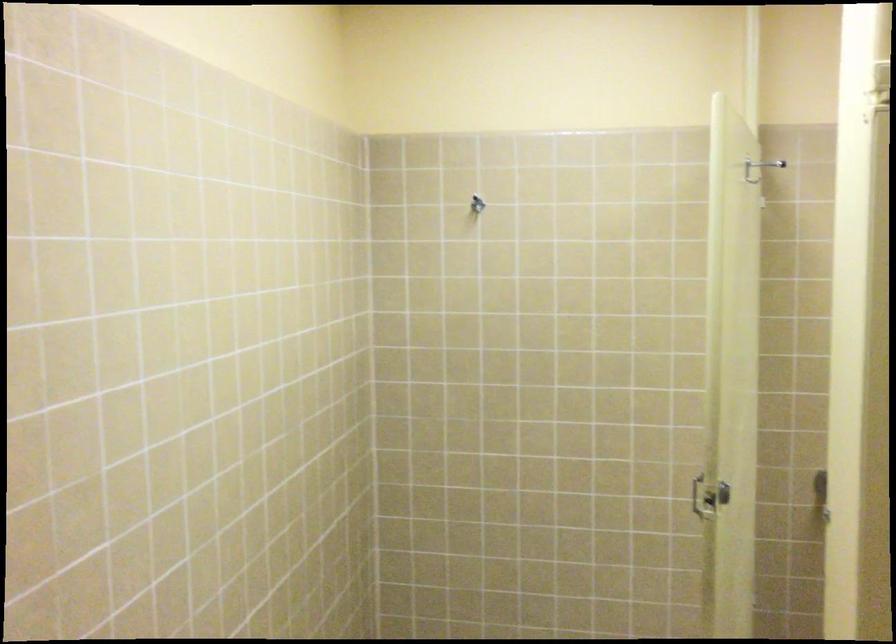
I want to click on stall door lock, so click(x=708, y=497).